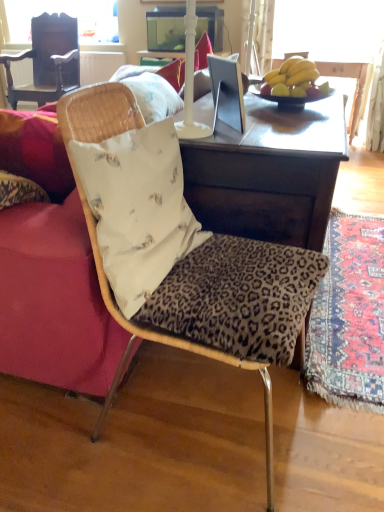
Question: From the image's perspective, is velvet red couch at left located above leopard print fabric chair at center, the first chair when ordered from bottom to top?

Choices:
 (A) no
 (B) yes

Answer: (B)

Question: Is velvet red couch at left outside leopard print fabric chair at center, marked as the second chair in a left-to-right arrangement?

Choices:
 (A) yes
 (B) no

Answer: (A)

Question: Does velvet red couch at left have a greater width compared to leopard print fabric chair at center, the 2th chair viewed from the back?

Choices:
 (A) no
 (B) yes

Answer: (B)

Question: Is velvet red couch at left bigger than leopard print fabric chair at center, arranged as the 1th chair when viewed from the front?

Choices:
 (A) no
 (B) yes

Answer: (B)

Question: Does velvet red couch at left appear on the right side of leopard print fabric chair at center, the first chair when ordered from bottom to top?

Choices:
 (A) yes
 (B) no

Answer: (B)

Question: From their relative heights in the image, would you say dark wood chair at upper left, the second chair in the right-to-left sequence, is taller or shorter than white fabric pillow at center?

Choices:
 (A) short
 (B) tall

Answer: (B)

Question: Based on their positions, is dark wood chair at upper left, which appears as the first chair when viewed from the top, located to the left or right of white fabric pillow at center?

Choices:
 (A) left
 (B) right

Answer: (A)

Question: Is point (69, 45) closer or farther from the camera than point (87, 155)?

Choices:
 (A) closer
 (B) farther

Answer: (B)

Question: In terms of width, does dark wood chair at upper left, the second chair in the right-to-left sequence, look wider or thinner when compared to white fabric pillow at center?

Choices:
 (A) wide
 (B) thin

Answer: (A)

Question: Is leopard print fabric chair at center, marked as the second chair in a left-to-right arrangement, to the left or to the right of carpet with intricate patterns at lower right in the image?

Choices:
 (A) left
 (B) right

Answer: (A)

Question: In terms of height, does leopard print fabric chair at center, arranged as the 1th chair when viewed from the front, look taller or shorter compared to carpet with intricate patterns at lower right?

Choices:
 (A) tall
 (B) short

Answer: (A)

Question: Based on their sizes in the image, would you say leopard print fabric chair at center, the 2th chair viewed from the back, is bigger or smaller than carpet with intricate patterns at lower right?

Choices:
 (A) small
 (B) big

Answer: (B)

Question: In the image, is leopard print fabric chair at center, marked as the second chair in a left-to-right arrangement, positioned in front of or behind carpet with intricate patterns at lower right?

Choices:
 (A) front
 (B) behind

Answer: (A)

Question: Is carpet with intricate patterns at lower right inside the boundaries of velvet red couch at left, or outside?

Choices:
 (A) outside
 (B) inside

Answer: (A)

Question: From the image's perspective, relative to velvet red couch at left, is carpet with intricate patterns at lower right above or below?

Choices:
 (A) above
 (B) below

Answer: (B)